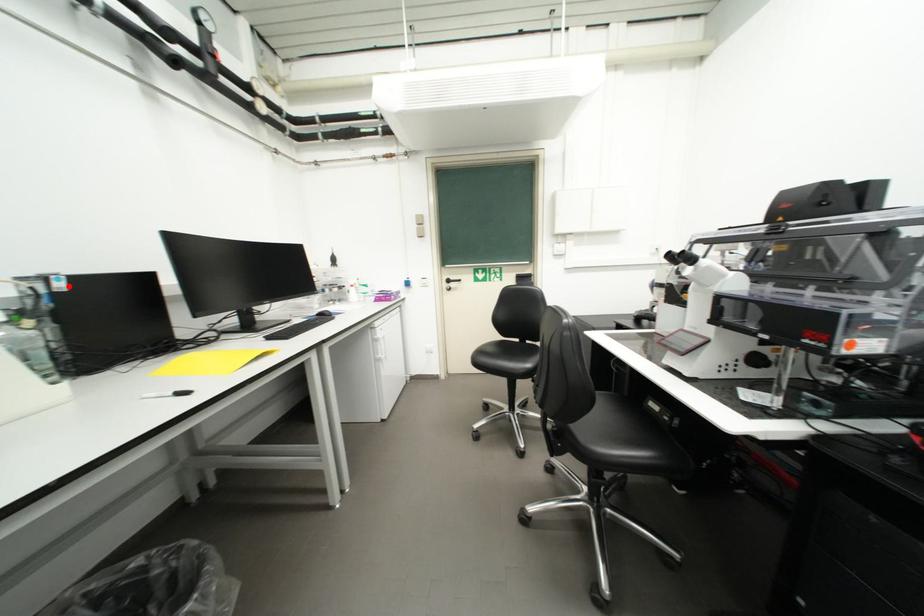
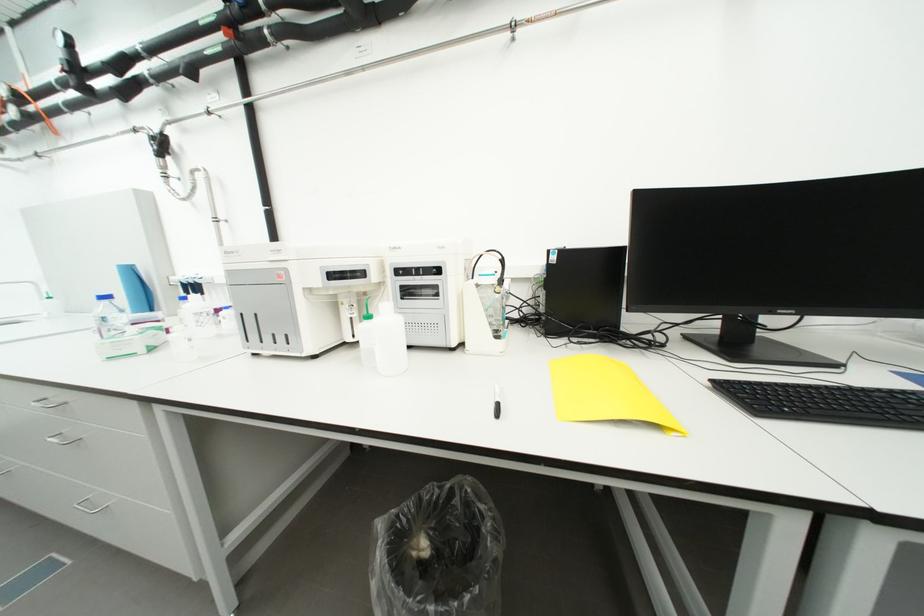
The point at the highlighted location is marked in the first image. Where is the corresponding point in the second image?

(562, 259)